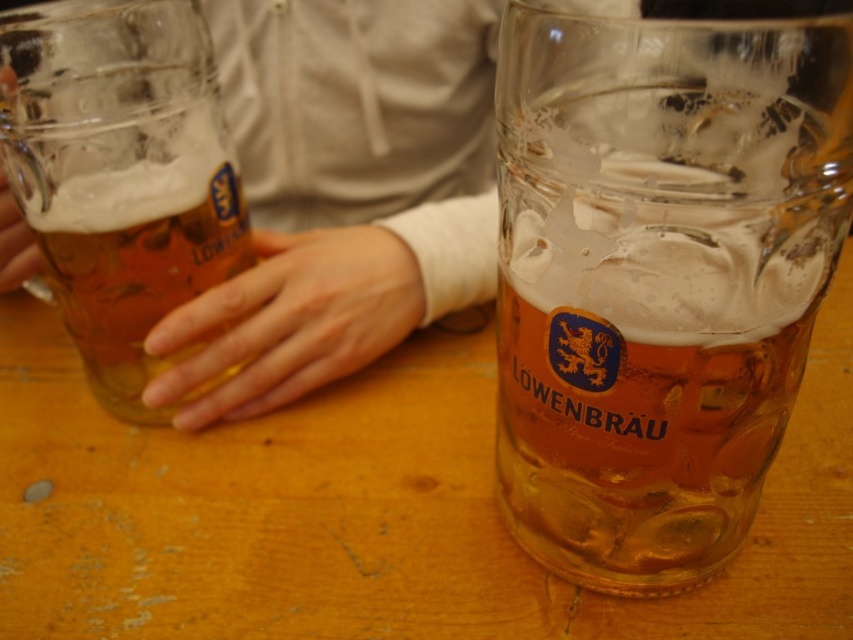
You are at a German beer festival and see the translucent glass mug at right and the matte skin hand at left on the table. Which object is closer to the right edge of the table?

The translucent glass mug at right is closer to the right edge of the table because it is positioned to the right of the matte skin hand at left.

You are a bartender who needs to place a coaster under the translucent glass mug at right to prevent condensation damage. The coaster has a diameter of 4 inches. Can you safely place the coaster directly under the mug without it touching any other objects?

The translucent glass mug at right is 8.72 inches away from the viewer. Since the coaster is 4 inches in diameter, placing it directly under the mug would require at least 2 inches of space on all sides to avoid touching other objects. However, there is no information provided about the proximity of other objects around the mug. Therefore, it is uncertain if the coaster can be placed safely without further details about the surrounding items.